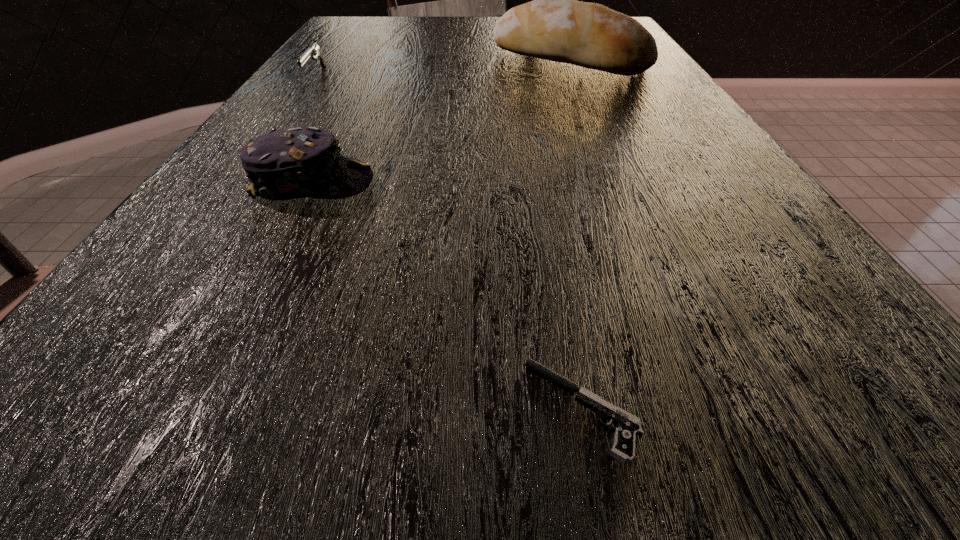
I want to click on free space between the farthest object and the fourth object from right to left, so tap(414, 102).

Where is `free point between the headwear and the bread`? free point between the headwear and the bread is located at coordinates (442, 122).

I want to click on unoccupied position between the shortest pistol and the third shortest object, so click(447, 296).

This screenshot has width=960, height=540. I want to click on blank region between the third shortest object and the bread, so click(442, 122).

Find the location of a particular element. This screenshot has width=960, height=540. unoccupied position between the farthest pistol and the nearest object is located at coordinates (548, 214).

Locate an element on the screen. object identified as the third closest to the tallest pistol is located at coordinates (297, 162).

The width and height of the screenshot is (960, 540). I want to click on the closest object to the nearest object, so (297, 162).

Locate an element on the screen. This screenshot has width=960, height=540. pistol that is the second nearest to the leftmost pistol is located at coordinates (628, 426).

Locate which pistol is the third closest to the bread. Please provide its 2D coordinates. Your answer should be formatted as a tuple, i.e. [(x, y)], where the tuple contains the x and y coordinates of a point satisfying the conditions above.

[(628, 426)]

In order to click on free space that satisfies the following two spatial constraints: 1. at the barrel of the farthest object; 2. on the front-facing side of the second nearest pistol in this screenshot , I will do `click(526, 77)`.